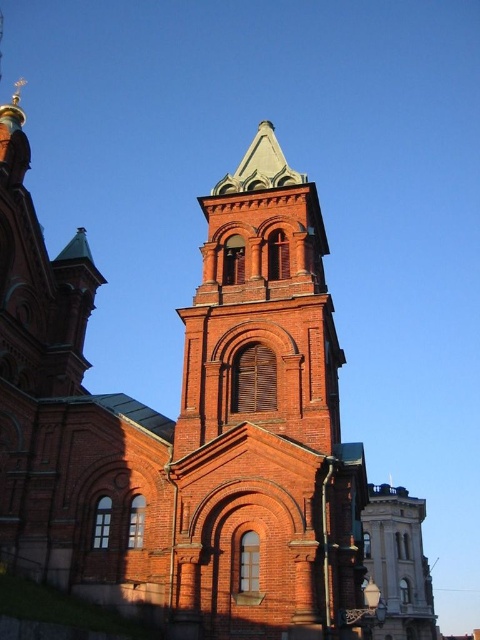
Question: Is red brick tower at center positioned before smooth gray stone tower at center?

Choices:
 (A) yes
 (B) no

Answer: (A)

Question: Which object is farther from the camera taking this photo?

Choices:
 (A) red brick tower at center
 (B) smooth gray stone tower at center

Answer: (B)

Question: Can you confirm if red brick tower at center is positioned below smooth gray stone tower at center?

Choices:
 (A) yes
 (B) no

Answer: (B)

Question: Which object appears farthest from the camera in this image?

Choices:
 (A) red brick tower at center
 (B) smooth gray stone tower at center

Answer: (B)

Question: Does red brick tower at center appear on the left side of smooth gray stone tower at center?

Choices:
 (A) no
 (B) yes

Answer: (B)